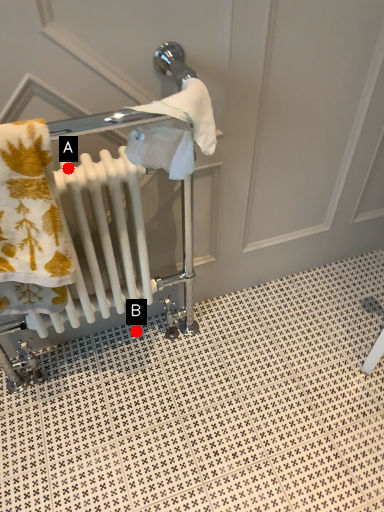
Question: Two points are circled on the image, labeled by A and B beside each circle. Which point is closer to the camera?

Choices:
 (A) A is closer
 (B) B is closer

Answer: (A)